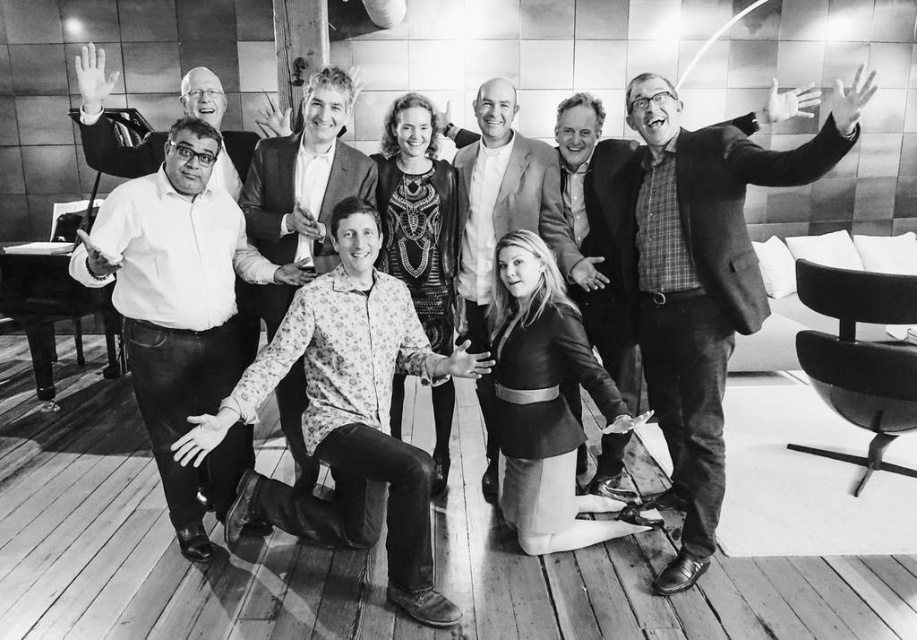
Who is higher up, smooth white shirt at left or floral shirt at center?

floral shirt at center is above.

Between point (186, 234) and point (316, 120), which one is positioned in front?

Positioned in front is point (186, 234).

The height and width of the screenshot is (640, 917). What are the coordinates of `smooth white shirt at left` in the screenshot? It's located at (175, 300).

Does plaid fabric shirt at right lie in front of leather jacket at center?

Yes, plaid fabric shirt at right is in front of leather jacket at center.

Identify the location of plaid fabric shirt at right. (704, 282).

Which is in front, point (759, 284) or point (584, 282)?

Point (759, 284) is in front.

In order to click on plaid fabric shirt at right in this screenshot , I will do pos(704,282).

Which is in front, point (393, 280) or point (565, 205)?

Positioned in front is point (393, 280).

Describe the element at coordinates (348, 416) in the screenshot. This screenshot has height=640, width=917. I see `floral-patterned shirt at center` at that location.

Describe the element at coordinates (348, 416) in the screenshot. I see `floral-patterned shirt at center` at that location.

The width and height of the screenshot is (917, 640). Identify the location of floral-patterned shirt at center. (348, 416).